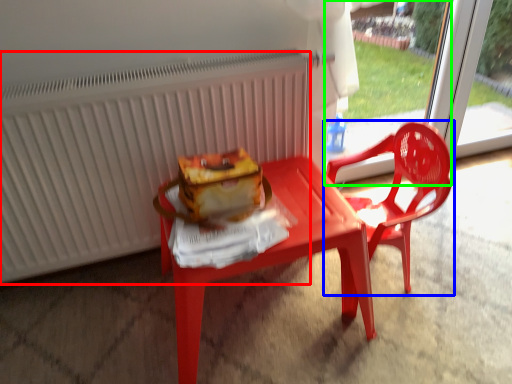
Question: Which object is positioned closest to radiator (highlighted by a red box)? Select from chair (highlighted by a blue box) and screen door (highlighted by a green box).

Choices:
 (A) chair
 (B) screen door

Answer: (A)